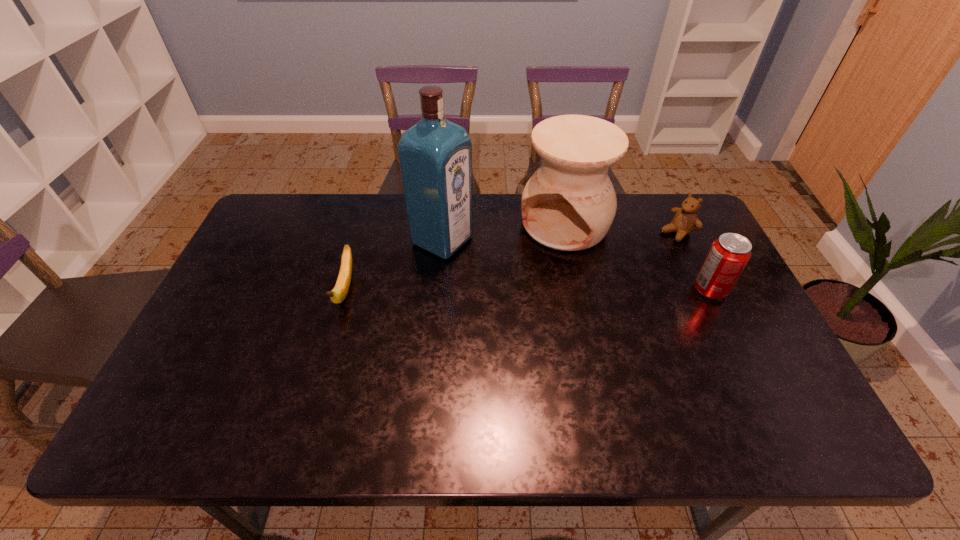
Select which object appears as the closest to the teddy bear. Please provide its 2D coordinates. Your answer should be formatted as a tuple, i.e. [(x, y)], where the tuple contains the x and y coordinates of a point satisfying the conditions above.

[(729, 254)]

This screenshot has width=960, height=540. In order to click on free space that satisfies the following two spatial constraints: 1. on the back side of the teddy bear; 2. on the right side of the liquor in this screenshot , I will do `click(444, 232)`.

Image resolution: width=960 pixels, height=540 pixels. I want to click on free spot that satisfies the following two spatial constraints: 1. on the front side of the third shortest object; 2. on the left side of the second shortest object, so point(705,290).